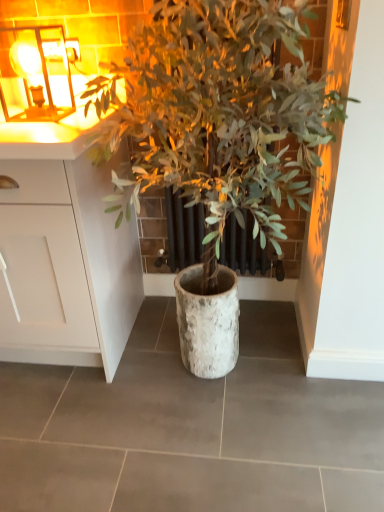
Question: Is green leafy plant at center at the right side of metallic glass at upper left?

Choices:
 (A) no
 (B) yes

Answer: (B)

Question: From the image's perspective, is green leafy plant at center over metallic glass at upper left?

Choices:
 (A) yes
 (B) no

Answer: (B)

Question: Does green leafy plant at center have a smaller size compared to metallic glass at upper left?

Choices:
 (A) yes
 (B) no

Answer: (B)

Question: Is green leafy plant at center aimed at metallic glass at upper left?

Choices:
 (A) no
 (B) yes

Answer: (A)

Question: Is green leafy plant at center in front of metallic glass at upper left?

Choices:
 (A) yes
 (B) no

Answer: (A)

Question: Is green leafy plant at center taller than metallic glass at upper left?

Choices:
 (A) yes
 (B) no

Answer: (A)

Question: Is white matte cabinet at left at the back of metallic glass at upper left?

Choices:
 (A) no
 (B) yes

Answer: (A)

Question: Does metallic glass at upper left have a lesser width compared to white matte cabinet at left?

Choices:
 (A) yes
 (B) no

Answer: (A)

Question: Does metallic glass at upper left come in front of white matte cabinet at left?

Choices:
 (A) yes
 (B) no

Answer: (B)

Question: Is metallic glass at upper left to the right of white matte cabinet at left from the viewer's perspective?

Choices:
 (A) no
 (B) yes

Answer: (B)

Question: Is metallic glass at upper left smaller than white matte cabinet at left?

Choices:
 (A) yes
 (B) no

Answer: (A)

Question: Does metallic glass at upper left touch white matte cabinet at left?

Choices:
 (A) no
 (B) yes

Answer: (A)

Question: Can you confirm if white matte cabinet at left is positioned to the right of green leafy plant at center?

Choices:
 (A) no
 (B) yes

Answer: (A)